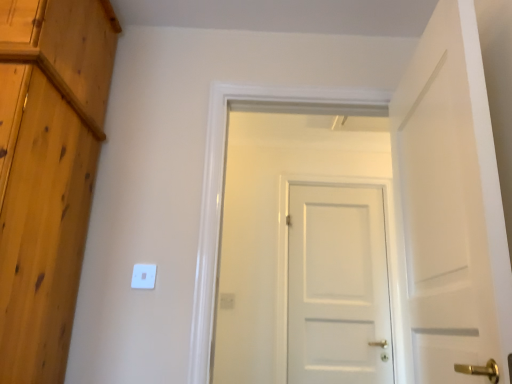
Question: Is point (222, 307) positioned closer to the camera than point (135, 271)?

Choices:
 (A) farther
 (B) closer

Answer: (A)

Question: Considering the positions of white plastic electric outlet at center and white plastic light switch at center in the image, is white plastic electric outlet at center bigger or smaller than white plastic light switch at center?

Choices:
 (A) big
 (B) small

Answer: (A)

Question: Estimate the real-world distances between objects in this image. Which object is closer to the white matte door at center, positioned as the first door in back-to-front order?

Choices:
 (A) white plastic electric outlet at center
 (B) white matte door at center, the second door in the front-to-back sequence
 (C) white matte door at center, which is counted as the third door, starting from the back
 (D) white plastic light switch at center

Answer: (B)

Question: Considering the real-world distances, which object is closest to the white plastic electric outlet at center?

Choices:
 (A) white matte door at center, the second door in the front-to-back sequence
 (B) white matte door at center, arranged as the third door when viewed from the front
 (C) white matte door at center, the 1th door when ordered from front to back
 (D) white plastic light switch at center

Answer: (A)